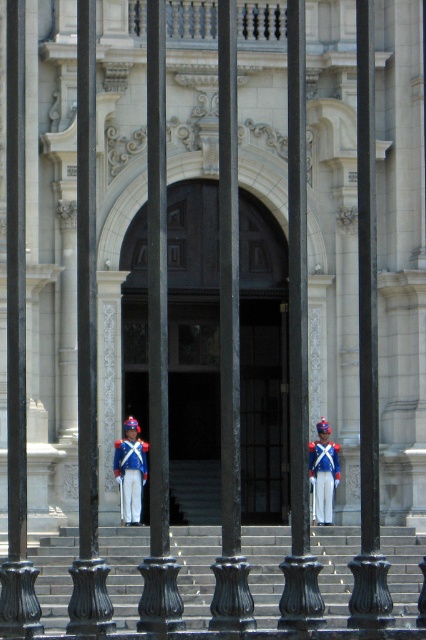
Does black metal pole at center have a lesser height compared to blue glossy uniform at center?

Incorrect, black metal pole at center's height does not fall short of blue glossy uniform at center's.

This screenshot has width=426, height=640. I want to click on black metal pole at center, so click(86, 348).

Does black wrought iron pole at center appear on the left side of blue fabric uniform at center?

Yes, black wrought iron pole at center is to the left of blue fabric uniform at center.

Is black wrought iron pole at center further to the viewer compared to blue fabric uniform at center?

No, it is in front of blue fabric uniform at center.

This screenshot has height=640, width=426. What do you see at coordinates (299, 348) in the screenshot?
I see `black wrought iron pole at center` at bounding box center [299, 348].

Find the location of a particular element. The image size is (426, 640). black wrought iron pole at center is located at coordinates (299, 348).

Is gray concrete stairs at center to the left of black wrought iron pole at center from the viewer's perspective?

Correct, you'll find gray concrete stairs at center to the left of black wrought iron pole at center.

Can you confirm if gray concrete stairs at center is bigger than black wrought iron pole at center?

Incorrect, gray concrete stairs at center is not larger than black wrought iron pole at center.

Is point (196, 532) positioned before point (299, 472)?

No.

Where is `gray concrete stairs at center`? gray concrete stairs at center is located at coordinates (195, 570).